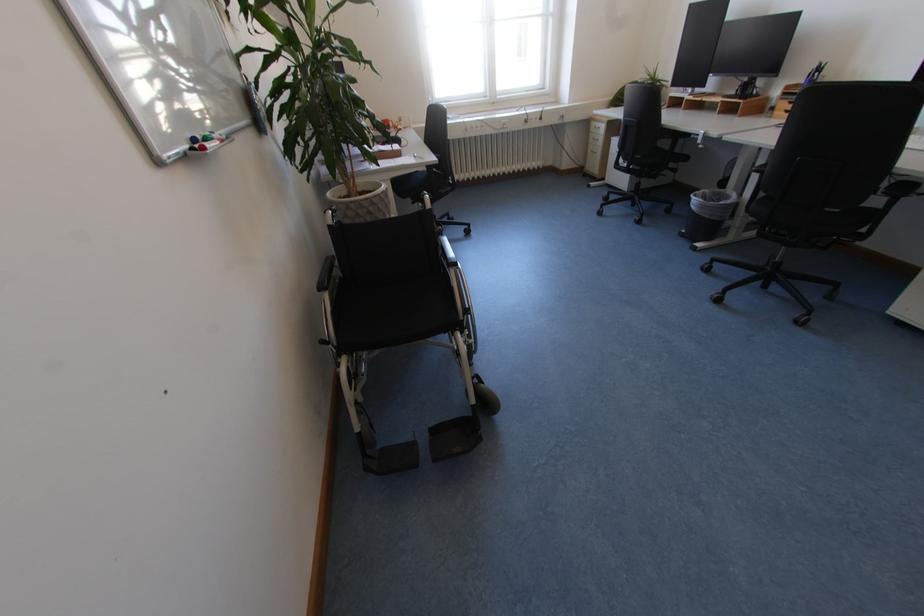
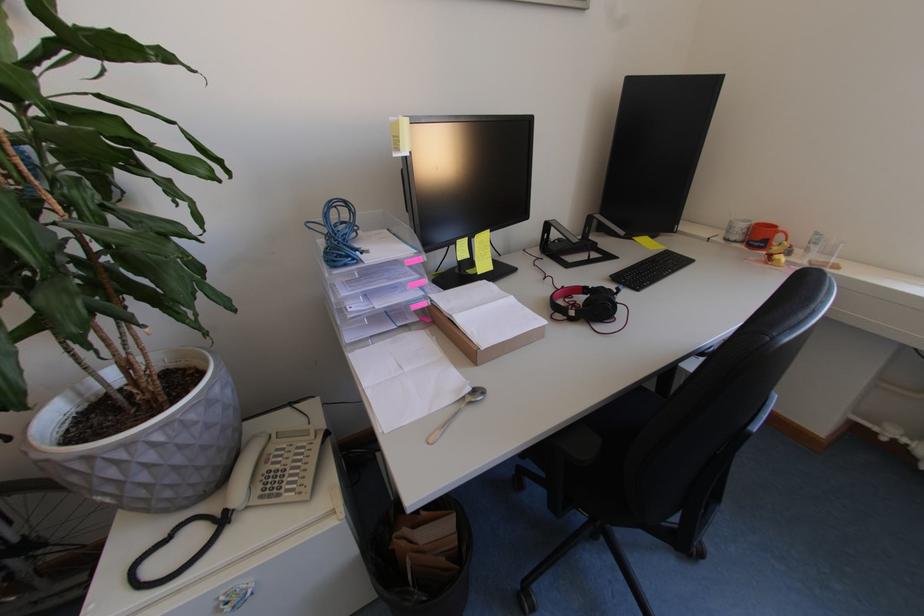
Where in the second image is the point corresponding to point 408,126 from the first image?

(816, 253)